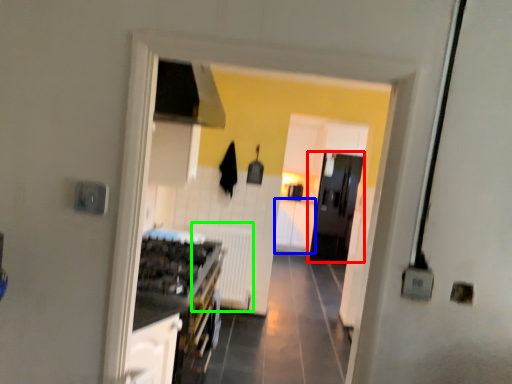
Question: Which is farther away from door (highlighted by a red box)? cabinetry (highlighted by a blue box) or radiator (highlighted by a green box)?

Choices:
 (A) cabinetry
 (B) radiator

Answer: (B)